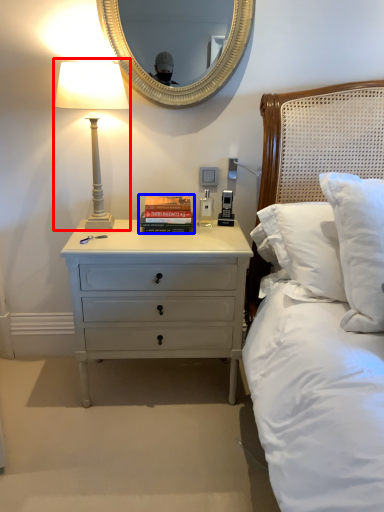
Question: Which object appears farthest to the camera in this image, bedside lamp (highlighted by a red box) or paperback book (highlighted by a blue box)?

Choices:
 (A) bedside lamp
 (B) paperback book

Answer: (B)